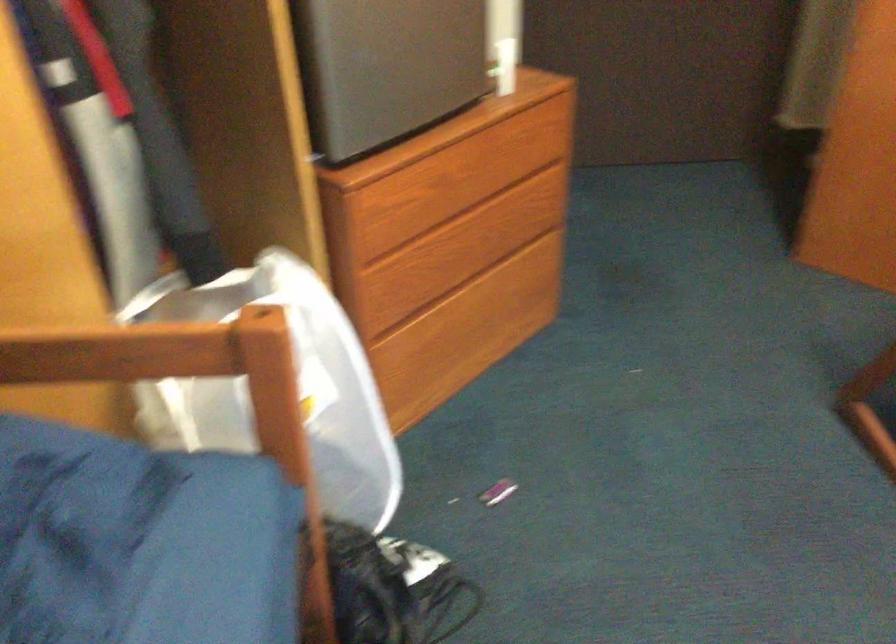
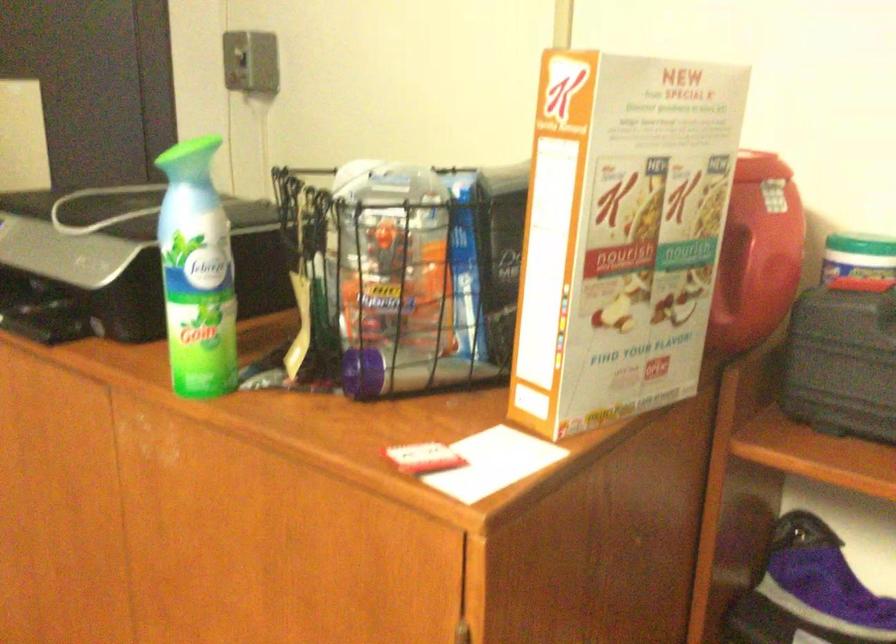
Which direction would the cameraman need to move to produce the second image?

The cameraman walked toward right, forward.